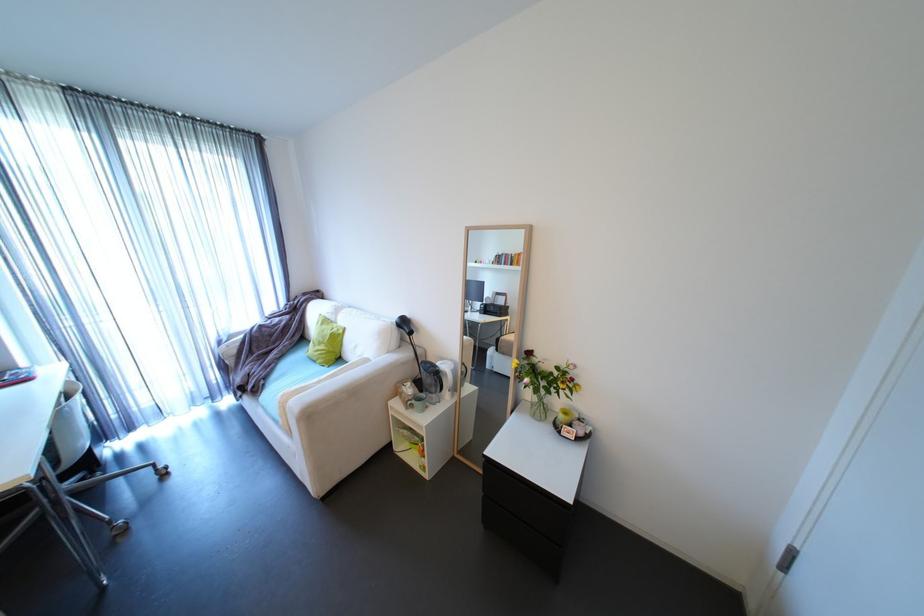
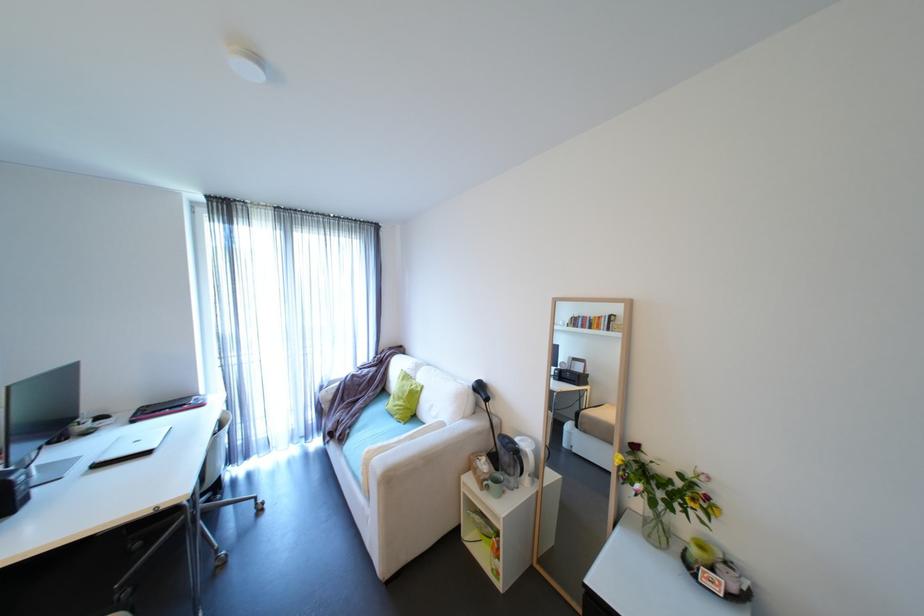
Question: The camera is either moving clockwise (left) or counter-clockwise (right) around the object. The first image is from the beginning of the video and the second image is from the end. Is the camera moving left or right when shooting the video?

Choices:
 (A) Left
 (B) Right

Answer: (B)